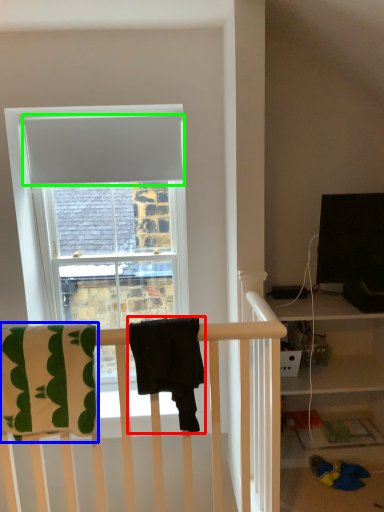
Question: Which is nearer to the beach towel (highlighted by a red box)? beach towel (highlighted by a blue box) or curtain (highlighted by a green box).

Choices:
 (A) beach towel
 (B) curtain

Answer: (A)